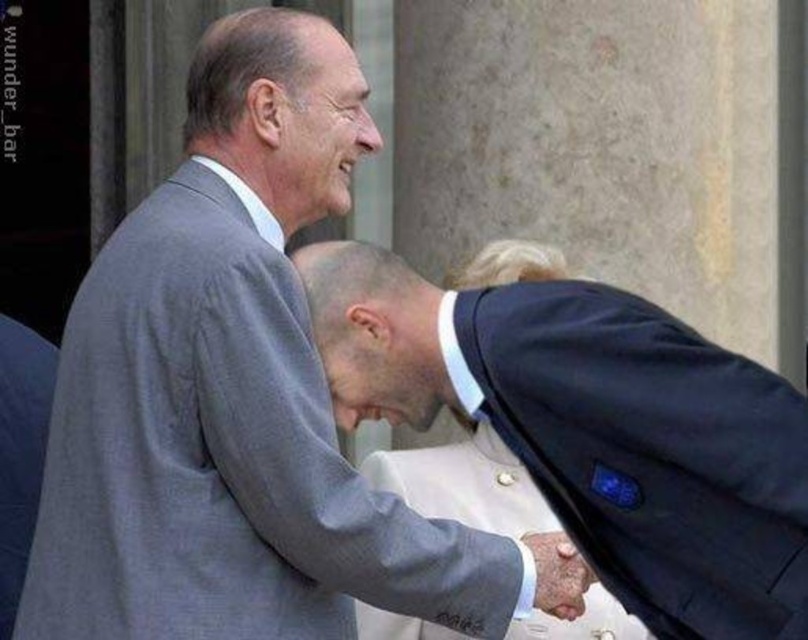
You are a photographer at a business event. You need to capture a photo of the dark blue suit at center and the smooth leather hand at center. The camera can only focus on objects within a 30 cm diameter. Given their sizes, will both fit within this focus range?

The dark blue suit at center has a smaller size compared to smooth leather hand at center. Since the camera requires both to be within 30 cm diameter, the larger object may exceed the focus range. Therefore, it might not fit.

You are a photographer trying to capture the handshake between the two men. You want to ensure that the point at coordinates point (234, 394) is visible in the frame. Based on the scene, where is this point located?

The point (234, 394) is located on the gray suit at center, so to ensure it is visible, the photographer should frame the image to include the central area where the gray suit is positioned.